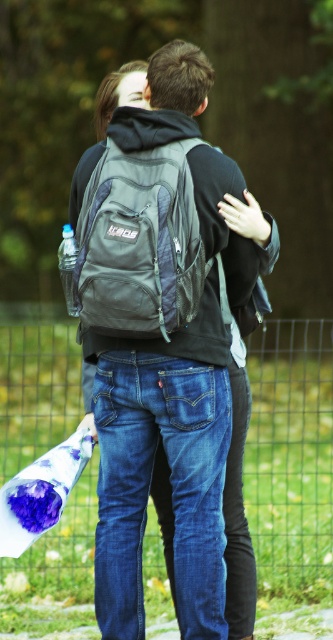
Question: Does wire mesh fence at center appear under gray fabric backpack at center?

Choices:
 (A) no
 (B) yes

Answer: (B)

Question: Is wire mesh fence at center closer to camera compared to gray fabric backpack at center?

Choices:
 (A) no
 (B) yes

Answer: (A)

Question: Does wire mesh fence at center appear on the right side of clear plastic bottle at left?

Choices:
 (A) yes
 (B) no

Answer: (A)

Question: Among these points, which one is nearest to the camera?

Choices:
 (A) (113, 632)
 (B) (305, 387)
 (C) (66, 269)

Answer: (C)

Question: Which point is farther to the camera?

Choices:
 (A) (61, 269)
 (B) (122, 180)
 (C) (160, 314)

Answer: (A)

Question: Estimate the real-world distances between objects in this image. Which object is farther from the gray fabric backpack at center?

Choices:
 (A) clear plastic bottle at left
 (B) matte gray backpack at center
 (C) wire mesh fence at center

Answer: (C)